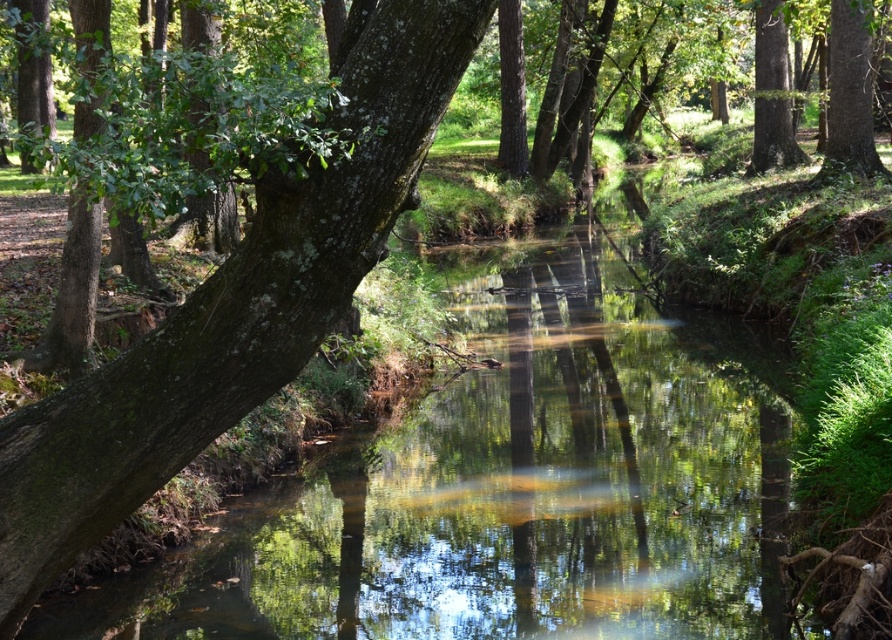
You are standing at the bottom left corner of the forest scene. You see two points marked in the image. Which point is closer to you, point (x=617, y=284) or point (x=267, y=216)?

Point (x=267, y=216) is closer to you because it is in front of point (x=617, y=284), which is behind it.